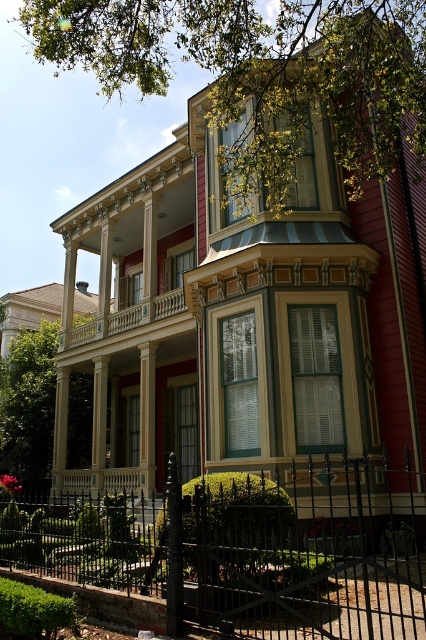
Who is lower down, black wrought iron fence at center or smooth cream railing at upper center?

black wrought iron fence at center is lower down.

Who is more distant from viewer, [250,508] or [178,312]?

Positioned behind is point [178,312].

Which is behind, point (40, 554) or point (97, 326)?

The point (97, 326) is more distant.

This screenshot has width=426, height=640. Identify the location of black wrought iron fence at center. (245, 548).